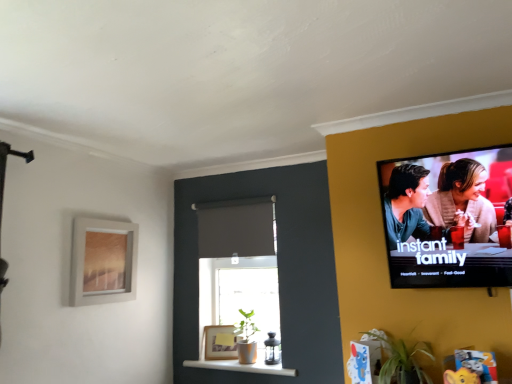
Question: Considering their positions, is green leafy plant at lower right located in front of or behind matte gray curtain at center?

Choices:
 (A) behind
 (B) front

Answer: (B)

Question: From a real-world perspective, is green leafy plant at lower right positioned above or below matte gray curtain at center?

Choices:
 (A) above
 (B) below

Answer: (B)

Question: Which object is positioned closest to the green leafy plant at lower right?

Choices:
 (A) matte black tv at upper right
 (B) matte silver picture frame at upper left, placed as the second picture frame when sorted from right to left
 (C) matte gray curtain at center
 (D) matte gold picture frame at lower center, arranged as the 2th picture frame when viewed from the left
 (E) white glossy shelf at lower center

Answer: (A)

Question: Which of these objects is positioned closest to the matte silver picture frame at upper left, arranged as the 1th picture frame when viewed from the front?

Choices:
 (A) matte gold picture frame at lower center, the second picture frame when ordered from top to bottom
 (B) matte gray curtain at center
 (C) green leafy plant at lower right
 (D) matte black tv at upper right
 (E) white glossy shelf at lower center

Answer: (B)